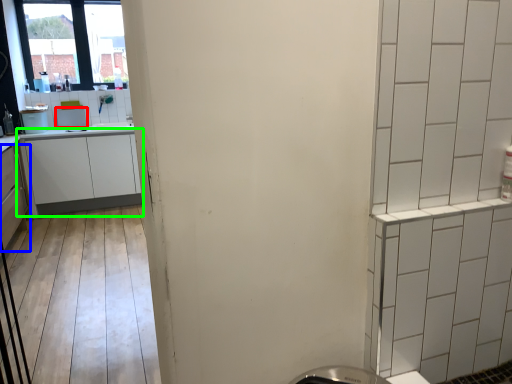
Question: Which is nearer to the appliance (highlighted by a red box)? cabinetry (highlighted by a blue box) or cabinetry (highlighted by a green box).

Choices:
 (A) cabinetry
 (B) cabinetry

Answer: (B)